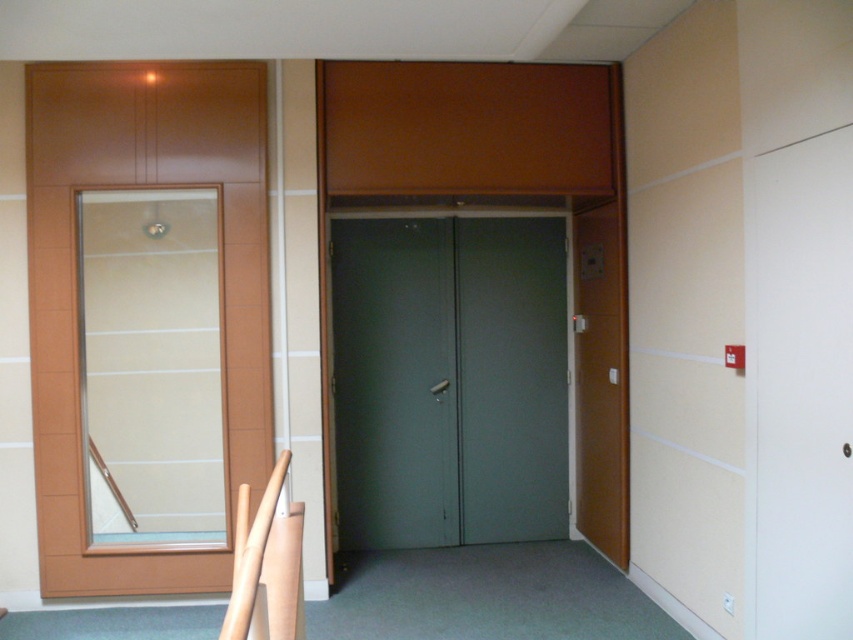
Does transparent glass door at left appear under matte gray door at center?

Incorrect, transparent glass door at left is not positioned below matte gray door at center.

Is point (155, 244) behind point (468, 412)?

No, it is in front of (468, 412).

Locate an element on the screen. transparent glass door at left is located at coordinates (152, 365).

Is transparent glass door at center in front of matte gray door at center?

Yes, it is.

Is point (340, 352) behind point (561, 294)?

No, it is in front of (561, 294).

Locate an element on the screen. The height and width of the screenshot is (640, 853). transparent glass door at center is located at coordinates (450, 380).

Is matte gray door at center below matte brown door at right?

Indeed, matte gray door at center is positioned under matte brown door at right.

Who is more forward, [482,468] or [607,458]?

Point [607,458]

This screenshot has width=853, height=640. I want to click on matte gray door at center, so click(511, 378).